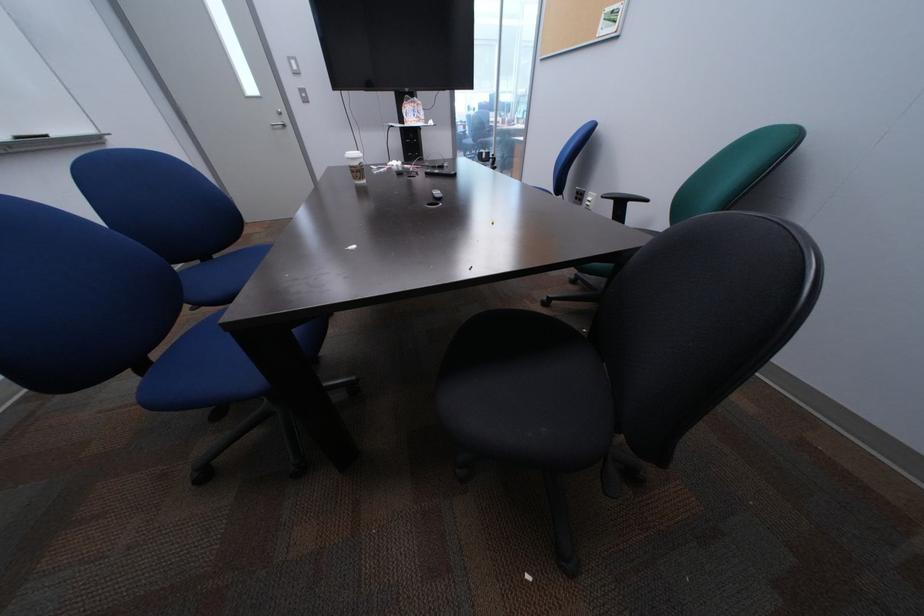
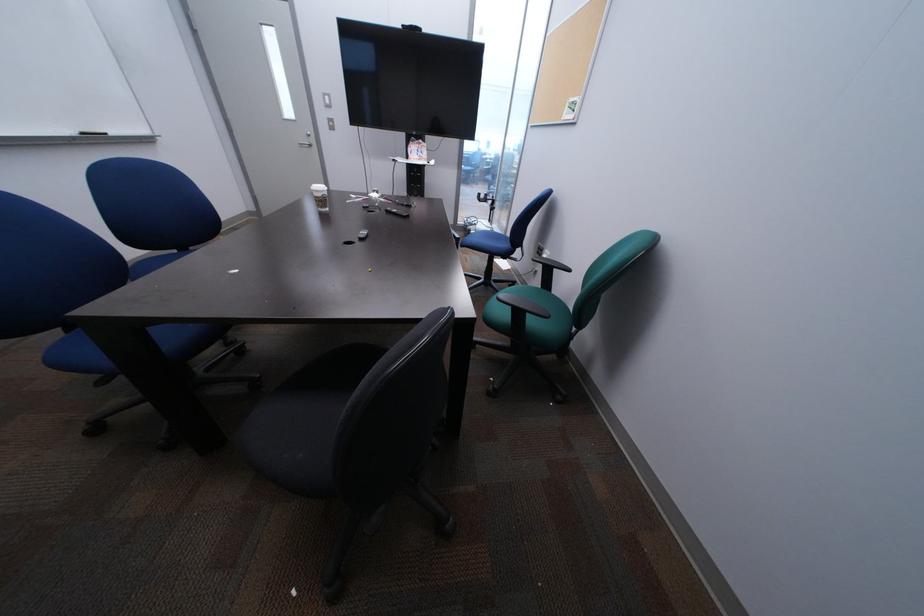
Question: The camera is either moving clockwise (left) or counter-clockwise (right) around the object. The first image is from the beginning of the video and the second image is from the end. Is the camera moving left or right when shooting the video?

Choices:
 (A) Left
 (B) Right

Answer: (B)